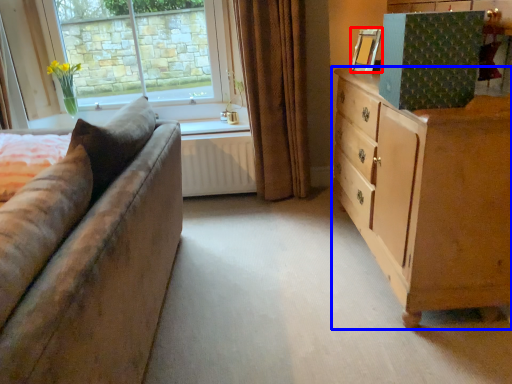
Question: Among these objects, which one is nearest to the camera, picture frame (highlighted by a red box) or chest of drawers (highlighted by a blue box)?

Choices:
 (A) picture frame
 (B) chest of drawers

Answer: (B)